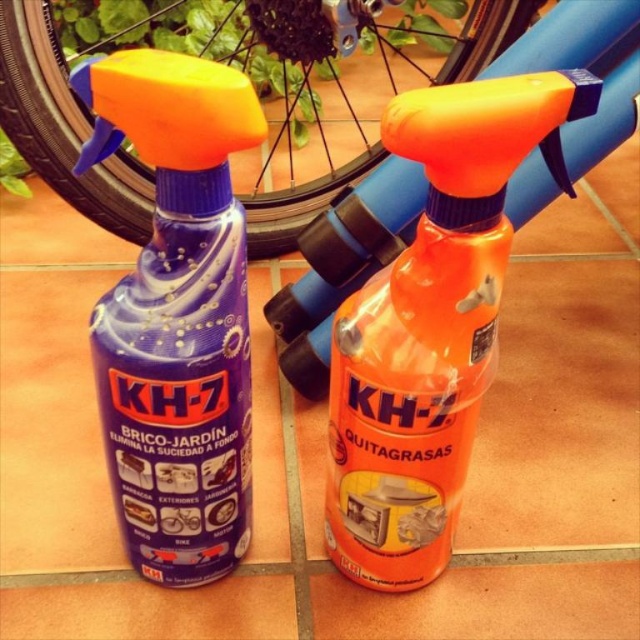
You are organizing a garage sale and need to place two spray bottles on a shelf. The shelf is only 6 inches wide. Can both the matte plastic spray bottle at left and the orange matte spray bottle at center fit side by side on the shelf without overlapping?

The matte plastic spray bottle at left is 5.50 inches from the orange matte spray bottle at center. Since the distance between them is less than the shelf width of 6 inches, both bottles can fit side by side on the shelf without overlapping.

You need to choose between the orange matte spray bottle at center and the black rubber tire at upper center to store in a narrow drawer. Which one would you choose and why?

The orange matte spray bottle at center is thinner than the black rubber tire at upper center, so it would fit better in a narrow drawer.

You are a gardener who needs to clean the black rubber tire at upper center. You have the orange matte spray bottle at center. Where should you position the spray bottle relative to the tire to effectively clean it?

The orange matte spray bottle at center is below the black rubber tire at upper center, so you should move it upwards to spray the tire effectively.